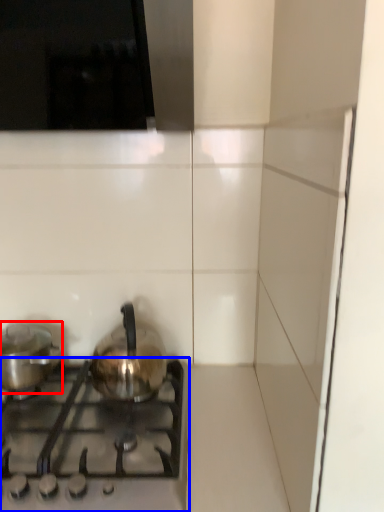
Question: Which object is further to the camera taking this photo, kitchen appliance (highlighted by a red box) or gas stove (highlighted by a blue box)?

Choices:
 (A) kitchen appliance
 (B) gas stove

Answer: (A)